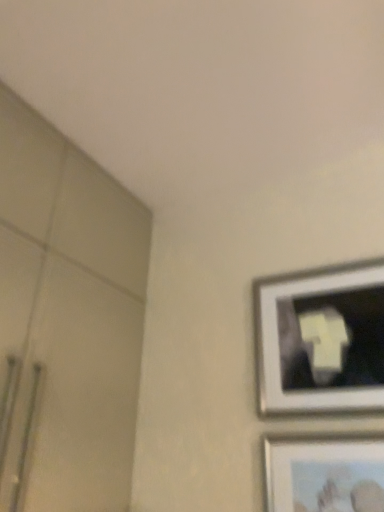
Question: Is matte silver picture frame at lower right, the first picture frame ordered from the bottom, inside the boundaries of metallic silver picture frame at upper right, which is counted as the 1th picture frame, starting from the top, or outside?

Choices:
 (A) outside
 (B) inside

Answer: (A)

Question: Considering the positions of point (296, 493) and point (350, 350), is point (296, 493) closer or farther from the camera than point (350, 350)?

Choices:
 (A) farther
 (B) closer

Answer: (B)

Question: In the image, is matte silver picture frame at lower right, the first picture frame ordered from the bottom, on the left side or the right side of metallic silver picture frame at upper right, the 2th picture frame when ordered from bottom to top?

Choices:
 (A) right
 (B) left

Answer: (A)

Question: Is metallic silver picture frame at upper right, the 2th picture frame when ordered from bottom to top, taller or shorter than matte silver picture frame at lower right, the first picture frame ordered from the bottom?

Choices:
 (A) tall
 (B) short

Answer: (A)

Question: Considering the relative positions of metallic silver picture frame at upper right, which is counted as the 1th picture frame, starting from the top, and matte silver picture frame at lower right, positioned as the second picture frame in top-to-bottom order, in the image provided, is metallic silver picture frame at upper right, which is counted as the 1th picture frame, starting from the top, to the left or to the right of matte silver picture frame at lower right, positioned as the second picture frame in top-to-bottom order,?

Choices:
 (A) left
 (B) right

Answer: (A)

Question: In terms of size, does metallic silver picture frame at upper right, the 2th picture frame when ordered from bottom to top, appear bigger or smaller than matte silver picture frame at lower right, positioned as the second picture frame in top-to-bottom order?

Choices:
 (A) small
 (B) big

Answer: (B)

Question: From the image's perspective, is metallic silver picture frame at upper right, which is counted as the 1th picture frame, starting from the top, above or below matte silver picture frame at lower right, the first picture frame ordered from the bottom?

Choices:
 (A) above
 (B) below

Answer: (A)